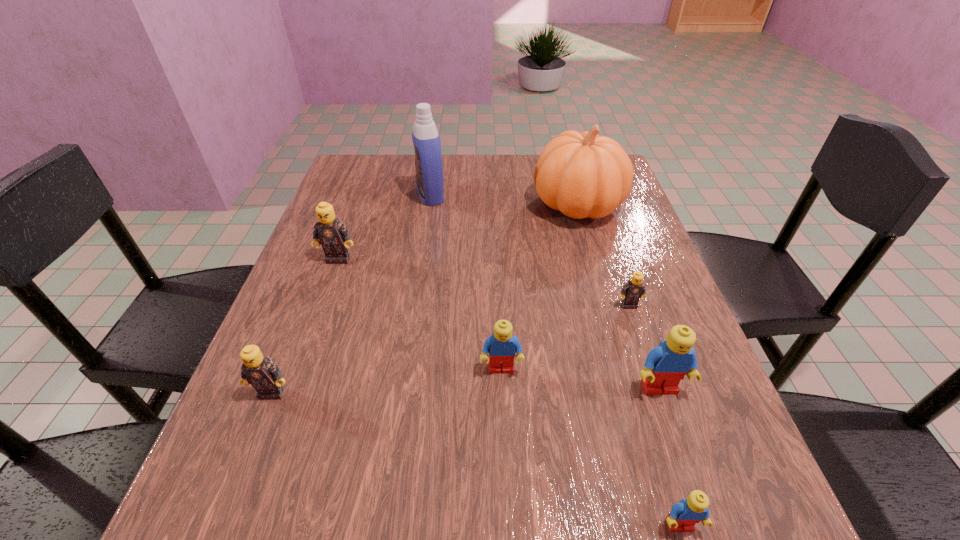
Locate which object ranks second in proximity to the second nearest tan Lego. Please provide its 2D coordinates. Your answer should be formatted as a tuple, i.e. [(x, y)], where the tuple contains the x and y coordinates of a point satisfying the conditions above.

[(582, 175)]

Where is `the fifth closest Lego to the blue detergent`? This screenshot has height=540, width=960. the fifth closest Lego to the blue detergent is located at coordinates (666, 365).

Point out which Lego is positioned as the fourth nearest to the third farthest object. Please provide its 2D coordinates. Your answer should be formatted as a tuple, i.e. [(x, y)], where the tuple contains the x and y coordinates of a point satisfying the conditions above.

[(666, 365)]

Choose which blue Lego is the second nearest neighbor to the nearest tan Lego. Please provide its 2D coordinates. Your answer should be formatted as a tuple, i.e. [(x, y)], where the tuple contains the x and y coordinates of a point satisfying the conditions above.

[(666, 365)]

Select which blue Lego appears as the second closest to the nearest object. Please provide its 2D coordinates. Your answer should be formatted as a tuple, i.e. [(x, y)], where the tuple contains the x and y coordinates of a point satisfying the conditions above.

[(502, 345)]

Identify which tan Lego is the closest to the rightmost tan Lego. Please provide its 2D coordinates. Your answer should be formatted as a tuple, i.e. [(x, y)], where the tuple contains the x and y coordinates of a point satisfying the conditions above.

[(333, 235)]

Identify the location of tan Lego object that ranks as the closest to the smallest tan Lego. The height and width of the screenshot is (540, 960). (333, 235).